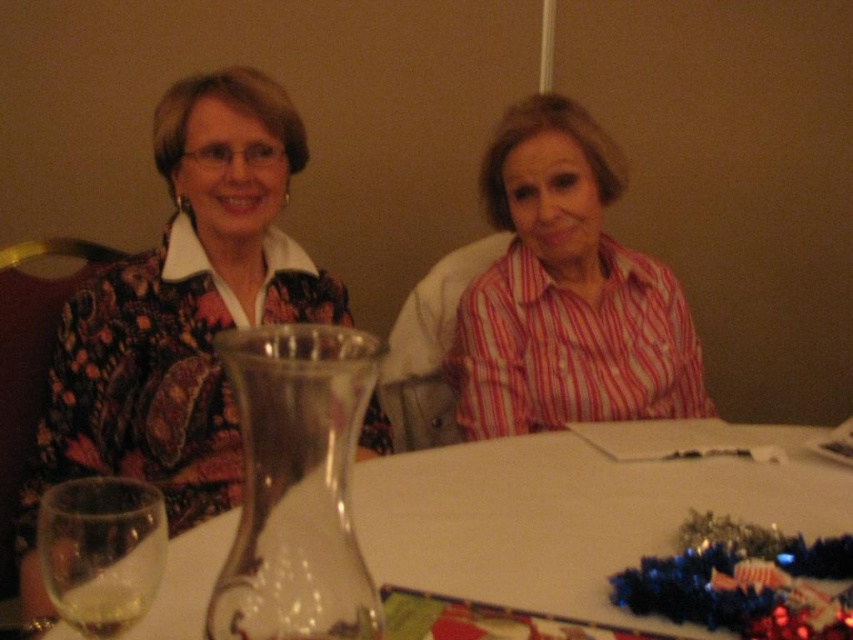
Question: Based on their relative distances, which object is nearer to the clear glass carafe at center?

Choices:
 (A) translucent glass at lower left
 (B) clear glass wine glass at lower left
 (C) pink striped shirt at center
 (D) printed fabric blouse at left

Answer: (C)

Question: Is clear glass carafe at center further to the viewer compared to pink striped shirt at center?

Choices:
 (A) no
 (B) yes

Answer: (A)

Question: Can you confirm if clear glass carafe at center is bigger than translucent glass at lower left?

Choices:
 (A) no
 (B) yes

Answer: (B)

Question: Considering the real-world distances, which object is closest to the clear glass carafe at center?

Choices:
 (A) printed fabric blouse at left
 (B) translucent glass at lower left
 (C) pink striped shirt at center

Answer: (C)

Question: Estimate the real-world distances between objects in this image. Which object is farther from the printed fabric blouse at left?

Choices:
 (A) clear glass carafe at center
 (B) clear glass wine glass at lower left

Answer: (B)

Question: Is clear glass carafe at center further to camera compared to pink striped shirt at center?

Choices:
 (A) yes
 (B) no

Answer: (B)